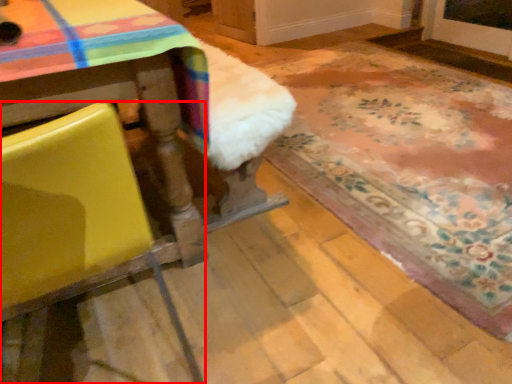
Question: In this image, where is chair (annotated by the red box) located relative to mat?

Choices:
 (A) left
 (B) right

Answer: (A)